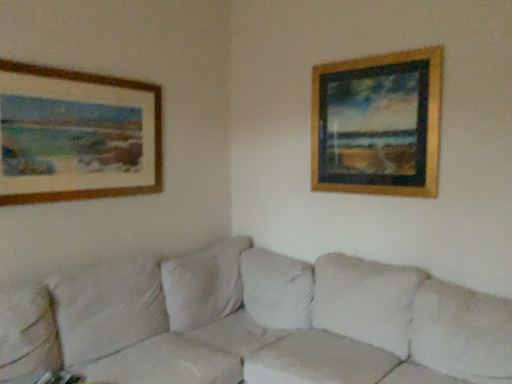
The image size is (512, 384). Identify the location of free space above wooden picture frame at upper left, which is the second picture frame in right-to-left order (from a real-world perspective). (82, 66).